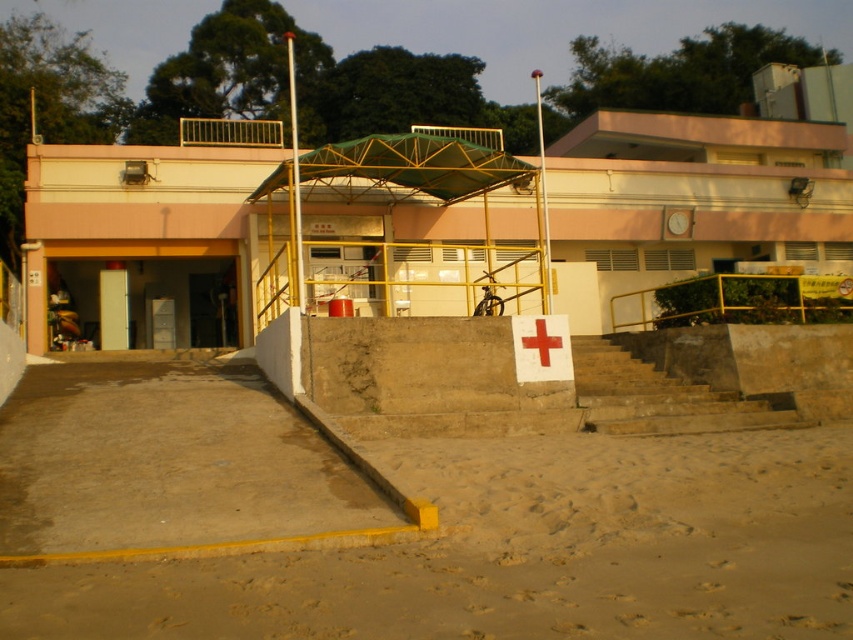
You are a visitor arriving at this medical facility and need to locate the entrance. Based on the image, which object is closer to the ground level? The sandy at lower center or the white paper cross at center?

The sandy at lower center is not as tall as the white paper cross at center, so the sandy at lower center is closer to the ground level.

You are a visitor approaching the building and see the brown stone stairs at center and the white paper cross at center. Which object is positioned to the left when viewed from the front of the building?

The white paper cross at center is positioned to the left of the brown stone stairs at center when viewed from the front of the building.